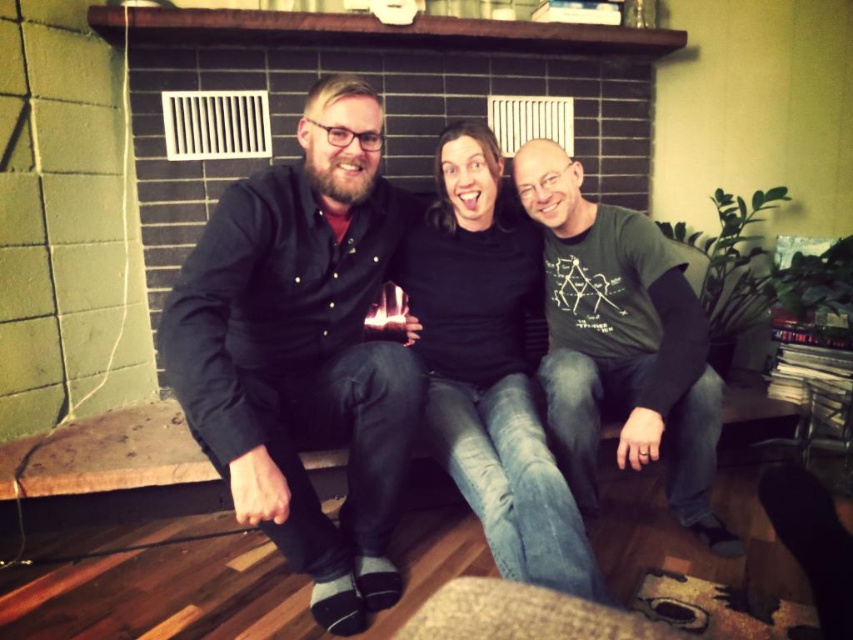
Question: Can you confirm if black matte shirt at left is positioned above green cotton t-shirt at center?

Choices:
 (A) no
 (B) yes

Answer: (B)

Question: From the image, what is the correct spatial relationship of black matte shirt at left in relation to black matte shirt at center?

Choices:
 (A) right
 (B) left

Answer: (B)

Question: Among these objects, which one is nearest to the camera?

Choices:
 (A) green cotton t-shirt at center
 (B) black matte shirt at center

Answer: (B)

Question: Based on their relative distances, which object is nearer to the green cotton t-shirt at center?

Choices:
 (A) black matte shirt at left
 (B) black matte shirt at center

Answer: (B)

Question: Which point is closer to the camera?

Choices:
 (A) (498, 259)
 (B) (369, 176)
 (C) (616, 221)

Answer: (B)

Question: Can you confirm if black matte shirt at center is positioned to the right of green cotton t-shirt at center?

Choices:
 (A) no
 (B) yes

Answer: (A)